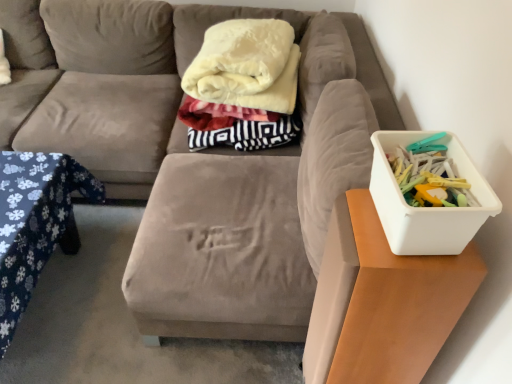
Describe the element at coordinates (35, 224) in the screenshot. The height and width of the screenshot is (384, 512). I see `blue fabric table at lower left, the 2th table viewed from the right` at that location.

Locate an element on the screen. white plastic container at right is located at coordinates (426, 208).

Considering the relative sizes of white plastic container at right and soft cream fleece blanket at center in the image provided, is white plastic container at right taller than soft cream fleece blanket at center?

Incorrect, the height of white plastic container at right is not larger of that of soft cream fleece blanket at center.

From the image's perspective, who appears lower, white plastic container at right or soft cream fleece blanket at center?

From the image's view, white plastic container at right is below.

Which object is thinner, white plastic container at right or soft cream fleece blanket at center?

With smaller width is white plastic container at right.

Is white plastic container at right not close to soft cream fleece blanket at center?

That's not correct — white plastic container at right is a little close to soft cream fleece blanket at center.

From the picture: Is white plastic container at right, which is counted as the first table, starting from the right, facing away from blue fabric table at lower left, marked as the 1th table in a left-to-right arrangement?

No, white plastic container at right, which is counted as the first table, starting from the right, is not facing the opposite direction of blue fabric table at lower left, marked as the 1th table in a left-to-right arrangement.

Is white plastic container at right, which is counted as the first table, starting from the right, thinner than blue fabric table at lower left, the 2th table viewed from the right?

Correct, the width of white plastic container at right, which is counted as the first table, starting from the right, is less than that of blue fabric table at lower left, the 2th table viewed from the right.

From the picture: Is white plastic container at right, which is counted as the first table, starting from the right, situated inside blue fabric table at lower left, the 2th table viewed from the right, or outside?

white plastic container at right, which is counted as the first table, starting from the right, exists outside the volume of blue fabric table at lower left, the 2th table viewed from the right.

At what (x,y) coordinates should I click in order to perform the action: click on table above the white plastic container at right, which is counted as the first table, starting from the right (from the image's perspective). Please return your answer as a coordinate pair (x, y). Looking at the image, I should click on (35, 224).

Which is more to the right, velvet beige couch at center or soft cream fleece blanket at center?

From the viewer's perspective, soft cream fleece blanket at center appears more on the right side.

From a real-world perspective, which is physically above, velvet beige couch at center or soft cream fleece blanket at center?

soft cream fleece blanket at center, from a real-world perspective.

Who is more distant, velvet beige couch at center or soft cream fleece blanket at center?

soft cream fleece blanket at center.

How distant is velvet beige couch at center from soft cream fleece blanket at center?

velvet beige couch at center and soft cream fleece blanket at center are 14.67 inches apart from each other.

From a real-world perspective, is velvet beige couch at center positioned above or below white plastic container at right?

velvet beige couch at center is below white plastic container at right.

Is point (65, 126) closer or farther from the camera than point (405, 133)?

Point (65, 126) is positioned farther from the camera compared to point (405, 133).

Is velvet beige couch at center positioned in front of white plastic container at right?

No.

Is white plastic container at right taller or shorter than white plastic container at right, which is counted as the first table, starting from the right?

Considering their sizes, white plastic container at right has less height than white plastic container at right, which is counted as the first table, starting from the right.

Is white plastic container at right beside white plastic container at right, the 2th table from the left?

No, white plastic container at right is not making contact with white plastic container at right, the 2th table from the left.

Which object is wider, white plastic container at right or white plastic container at right, the 2th table from the left?

Wider between the two is white plastic container at right, the 2th table from the left.

Is point (402, 218) more distant than point (325, 355)?

No, it is in front of (325, 355).

Considering the sizes of objects soft cream fleece blanket at center and blue fabric table at lower left, the 2th table viewed from the right, in the image provided, who is thinner, soft cream fleece blanket at center or blue fabric table at lower left, the 2th table viewed from the right,?

Thinner between the two is soft cream fleece blanket at center.

Which of these two, soft cream fleece blanket at center or blue fabric table at lower left, marked as the 1th table in a left-to-right arrangement, is bigger?

Bigger between the two is soft cream fleece blanket at center.

Is soft cream fleece blanket at center further to camera compared to blue fabric table at lower left, the 2th table viewed from the right?

Yes.

Considering the sizes of soft cream fleece blanket at center and blue fabric table at lower left, the 2th table viewed from the right, in the image, is soft cream fleece blanket at center taller or shorter than blue fabric table at lower left, the 2th table viewed from the right,?

Considering their sizes, soft cream fleece blanket at center has more height than blue fabric table at lower left, the 2th table viewed from the right.

Is point (36, 173) closer or farther from the camera than point (335, 288)?

Point (36, 173).

Which of these two, blue fabric table at lower left, the 2th table viewed from the right, or white plastic container at right, the 2th table from the left, is thinner?

white plastic container at right, the 2th table from the left, is thinner.

Looking at this image, is blue fabric table at lower left, marked as the 1th table in a left-to-right arrangement, to the left of white plastic container at right, the 2th table from the left, from the viewer's perspective?

Correct, you'll find blue fabric table at lower left, marked as the 1th table in a left-to-right arrangement, to the left of white plastic container at right, the 2th table from the left.

Considering the sizes of objects blue fabric table at lower left, marked as the 1th table in a left-to-right arrangement, and white plastic container at right, the 2th table from the left, in the image provided, who is bigger, blue fabric table at lower left, marked as the 1th table in a left-to-right arrangement, or white plastic container at right, the 2th table from the left,?

Bigger between the two is blue fabric table at lower left, marked as the 1th table in a left-to-right arrangement.

The height and width of the screenshot is (384, 512). In the image, there is a white plastic container at right. Find the location of `blanket above it (from the image's perspective)`. blanket above it (from the image's perspective) is located at coordinates (246, 66).

Where is `table behind the white plastic container at right, the 2th table from the left`? table behind the white plastic container at right, the 2th table from the left is located at coordinates pos(35,224).

Looking at the image, which one is located closer to velvet beige couch at center, white plastic container at right, which is counted as the first table, starting from the right, or soft cream fleece blanket at center?

soft cream fleece blanket at center is positioned closer to the anchor velvet beige couch at center.

From the image, which object appears to be farther from velvet beige couch at center, blue fabric table at lower left, the 2th table viewed from the right, or white plastic container at right, which is counted as the first table, starting from the right?

The object further to velvet beige couch at center is white plastic container at right, which is counted as the first table, starting from the right.

Estimate the real-world distances between objects in this image. Which object is further from soft cream fleece blanket at center, white plastic container at right or blue fabric table at lower left, the 2th table viewed from the right?

white plastic container at right is positioned further to the anchor soft cream fleece blanket at center.

Based on their spatial positions, is white plastic container at right, which is counted as the first table, starting from the right, or velvet beige couch at center closer to blue fabric table at lower left, the 2th table viewed from the right?

The object closer to blue fabric table at lower left, the 2th table viewed from the right, is velvet beige couch at center.

From the image, which object appears to be nearer to velvet beige couch at center, blue fabric table at lower left, the 2th table viewed from the right, or white plastic container at right?

blue fabric table at lower left, the 2th table viewed from the right.

Considering their positions, is soft cream fleece blanket at center positioned further to velvet beige couch at center than white plastic container at right, the 2th table from the left?

The object further to velvet beige couch at center is white plastic container at right, the 2th table from the left.

From the image, which object appears to be nearer to velvet beige couch at center, white plastic container at right or soft cream fleece blanket at center?

soft cream fleece blanket at center lies closer to velvet beige couch at center than the other object.

In the scene shown: From the image, which object appears to be nearer to blue fabric table at lower left, the 2th table viewed from the right, velvet beige couch at center or white plastic container at right?

velvet beige couch at center is closer to blue fabric table at lower left, the 2th table viewed from the right.

Image resolution: width=512 pixels, height=384 pixels. Find the location of `table between blue fabric table at lower left, marked as the 1th table in a left-to-right arrangement, and white plastic container at right from left to right`. table between blue fabric table at lower left, marked as the 1th table in a left-to-right arrangement, and white plastic container at right from left to right is located at coordinates (381, 302).

Find the location of a particular element. The image size is (512, 384). studio couch situated between blue fabric table at lower left, the 2th table viewed from the right, and white plastic container at right from left to right is located at coordinates (180, 151).

I want to click on studio couch between soft cream fleece blanket at center and white plastic container at right, the 2th table from the left, vertically, so click(180, 151).

This screenshot has height=384, width=512. Find the location of `studio couch situated between blue fabric table at lower left, the 2th table viewed from the right, and white plastic container at right, the 2th table from the left, from left to right`. studio couch situated between blue fabric table at lower left, the 2th table viewed from the right, and white plastic container at right, the 2th table from the left, from left to right is located at coordinates (180, 151).